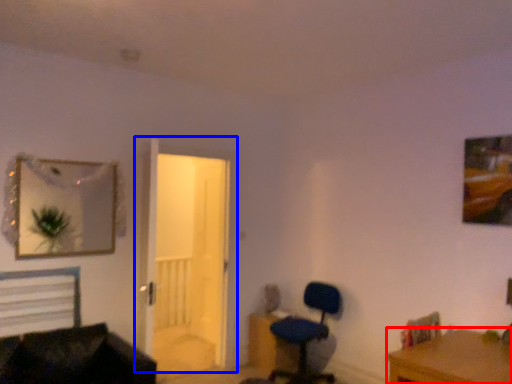
Question: Among these objects, which one is farthest to the camera, desk (highlighted by a red box) or door (highlighted by a blue box)?

Choices:
 (A) desk
 (B) door

Answer: (B)